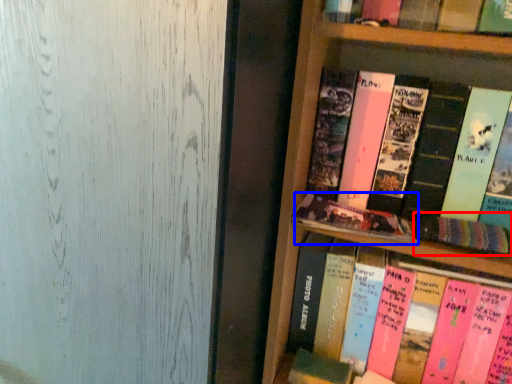
Question: Which object appears farthest to the camera in this image, book (highlighted by a red box) or book (highlighted by a blue box)?

Choices:
 (A) book
 (B) book

Answer: (B)